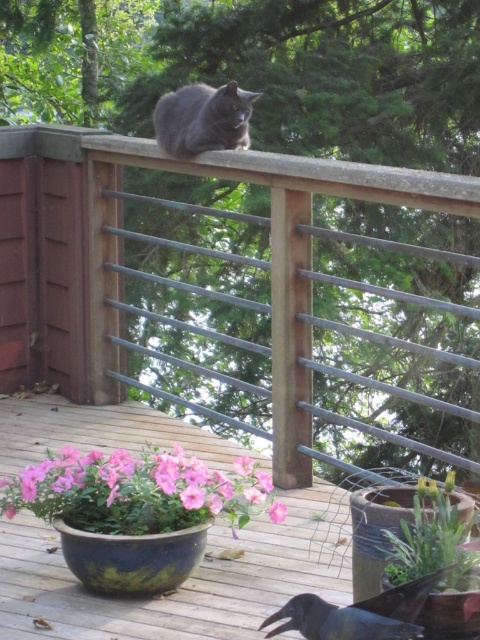
Can you confirm if metallic gray fence at upper center is positioned below pink matte flower pot at lower left?

Actually, metallic gray fence at upper center is above pink matte flower pot at lower left.

Locate an element on the screen. This screenshot has height=640, width=480. metallic gray fence at upper center is located at coordinates (120, 259).

Where is `metallic gray fence at upper center`? metallic gray fence at upper center is located at coordinates (120, 259).

What do you see at coordinates (186, 580) in the screenshot? The width and height of the screenshot is (480, 640). I see `wooden deck at center` at bounding box center [186, 580].

Can you confirm if wooden deck at center is positioned to the right of shiny gray cat at center?

Indeed, wooden deck at center is positioned on the right side of shiny gray cat at center.

The image size is (480, 640). Identify the location of wooden deck at center. [186, 580].

Locate an element on the screen. wooden deck at center is located at coordinates (186, 580).

What do you see at coordinates (120, 259) in the screenshot? The image size is (480, 640). I see `metallic gray fence at upper center` at bounding box center [120, 259].

Between metallic gray fence at upper center and pink matte flower at center, which one has more height?

metallic gray fence at upper center

Is point (27, 188) in front of point (284, 513)?

No.

Image resolution: width=480 pixels, height=640 pixels. I want to click on metallic gray fence at upper center, so click(x=120, y=259).